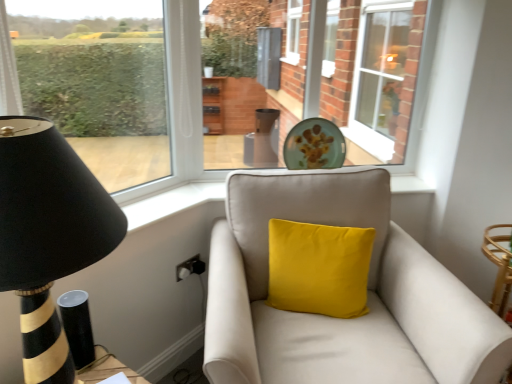
Question: In the image, is clear glass window at upper right, the second window positioned from the left, on the left side or the right side of transparent glass window at left, placed as the 2th window when sorted from back to front?

Choices:
 (A) left
 (B) right

Answer: (B)

Question: Is point (396, 142) positioned closer to the camera than point (10, 107)?

Choices:
 (A) farther
 (B) closer

Answer: (A)

Question: Estimate the real-world distances between objects in this image. Which object is closer to the suede beige couch at center?

Choices:
 (A) black striped wood table lamp at left
 (B) transparent glass window at left, marked as the second window in a right-to-left arrangement
 (C) matte glass plate at center
 (D) yellow velvet cushion at center
 (E) clear glass window at upper right, which ranks as the second window in front-to-back order

Answer: (D)

Question: Considering the real-world distances, which object is closest to the suede beige couch at center?

Choices:
 (A) clear glass window at upper right, the second window positioned from the left
 (B) transparent glass window at left, placed as the 2th window when sorted from back to front
 (C) matte glass plate at center
 (D) yellow velvet cushion at center
 (E) black striped wood table lamp at left

Answer: (D)